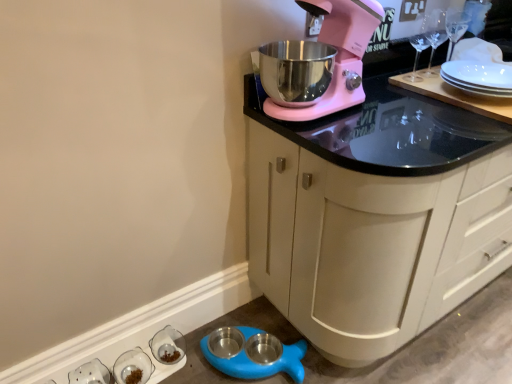
Question: Is clear glass bowl at lower left, arranged as the 3th tableware when viewed from the left, oriented away from white glossy salt and pepper shakers at lower left, acting as the 3th tableware starting from the right?

Choices:
 (A) yes
 (B) no

Answer: (B)

Question: Are clear glass bowl at lower left, arranged as the 3th tableware when viewed from the left, and white glossy salt and pepper shakers at lower left, which ranks as the 1th tableware in left-to-right order, located far from each other?

Choices:
 (A) no
 (B) yes

Answer: (A)

Question: Can you confirm if clear glass bowl at lower left, arranged as the 3th tableware when viewed from the left, is wider than white glossy salt and pepper shakers at lower left, which ranks as the 1th tableware in left-to-right order?

Choices:
 (A) yes
 (B) no

Answer: (A)

Question: Considering the relative positions of clear glass bowl at lower left, the 1th tableware viewed from the right, and white glossy salt and pepper shakers at lower left, which ranks as the 1th tableware in left-to-right order, in the image provided, is clear glass bowl at lower left, the 1th tableware viewed from the right, to the right of white glossy salt and pepper shakers at lower left, which ranks as the 1th tableware in left-to-right order, from the viewer's perspective?

Choices:
 (A) yes
 (B) no

Answer: (A)

Question: Is clear glass bowl at lower left, the 1th tableware viewed from the right, taller than white glossy salt and pepper shakers at lower left, which ranks as the 1th tableware in left-to-right order?

Choices:
 (A) yes
 (B) no

Answer: (B)

Question: Does point (274, 102) appear closer or farther from the camera than point (278, 362)?

Choices:
 (A) farther
 (B) closer

Answer: (B)

Question: From a real-world perspective, is pink matte mixer at upper right physically located above or below blue rubber pet bowls at lower left?

Choices:
 (A) above
 (B) below

Answer: (A)

Question: Considering the relative positions of pink matte mixer at upper right and blue rubber pet bowls at lower left in the image provided, is pink matte mixer at upper right to the left or to the right of blue rubber pet bowls at lower left?

Choices:
 (A) left
 (B) right

Answer: (B)

Question: Relative to blue rubber pet bowls at lower left, is pink matte mixer at upper right in front or behind?

Choices:
 (A) front
 (B) behind

Answer: (A)

Question: From a real-world perspective, relative to matte white cabinet at upper right, is blue rubber pet bowls at lower left vertically above or below?

Choices:
 (A) below
 (B) above

Answer: (A)

Question: Looking at the image, does blue rubber pet bowls at lower left seem bigger or smaller compared to matte white cabinet at upper right?

Choices:
 (A) small
 (B) big

Answer: (A)

Question: Is point (241, 329) closer or farther from the camera than point (426, 192)?

Choices:
 (A) closer
 (B) farther

Answer: (B)

Question: Looking at their shapes, would you say blue rubber pet bowls at lower left is wider or thinner than matte white cabinet at upper right?

Choices:
 (A) wide
 (B) thin

Answer: (B)

Question: Considering the positions of clear glass bowl at lower left, the 1th tableware viewed from the right, and clear glass bowls at lower left, the 2th tableware when ordered from left to right, in the image, is clear glass bowl at lower left, the 1th tableware viewed from the right, taller or shorter than clear glass bowls at lower left, the 2th tableware when ordered from left to right,?

Choices:
 (A) tall
 (B) short

Answer: (B)

Question: Based on their positions, is clear glass bowl at lower left, the 1th tableware viewed from the right, located to the left or right of clear glass bowls at lower left, the 2th tableware when ordered from left to right?

Choices:
 (A) right
 (B) left

Answer: (A)